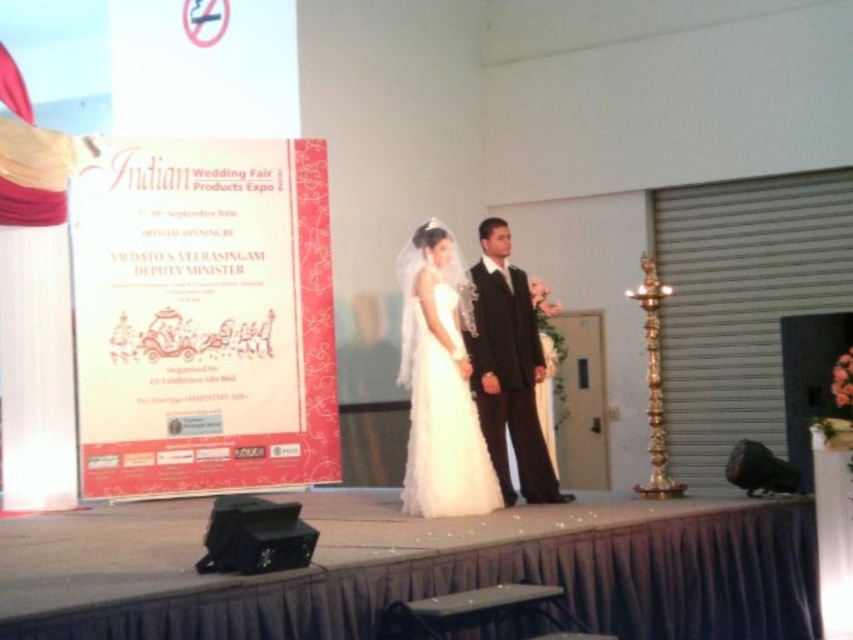
Is white satin dress at center further to camera compared to black satin suit at center?

No, white satin dress at center is closer to the viewer.

Does point (450, 452) come farther from viewer compared to point (537, 323)?

No.

What are the coordinates of `white satin dress at center` in the screenshot? It's located at (440, 385).